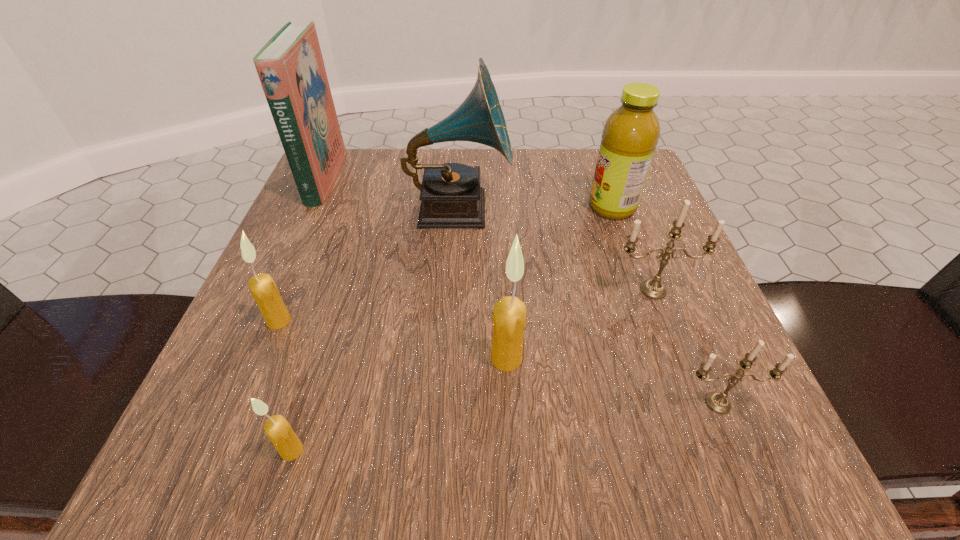
Locate an element on the screen. hardback book is located at coordinates (290, 66).

Identify the location of phonograph_record. (451, 197).

At what (x,y) coordinates should I click in order to perform the action: click on fruit juice. Please return your answer as a coordinate pair (x, y). This screenshot has height=540, width=960. Looking at the image, I should click on (630, 135).

The width and height of the screenshot is (960, 540). What are the coordinates of `the tallest candle` in the screenshot? It's located at (509, 314).

I want to click on the sixth farthest object, so click(509, 314).

The width and height of the screenshot is (960, 540). I want to click on the farthest cream candle, so click(262, 287).

Image resolution: width=960 pixels, height=540 pixels. In order to click on the fifth farthest object in this screenshot , I will do `click(262, 287)`.

Find the location of a particular element. the farthest candle is located at coordinates (653, 288).

I want to click on the bigger metallic candle, so click(x=653, y=288).

Image resolution: width=960 pixels, height=540 pixels. In order to click on the nearest object in this screenshot , I will do pos(278,430).